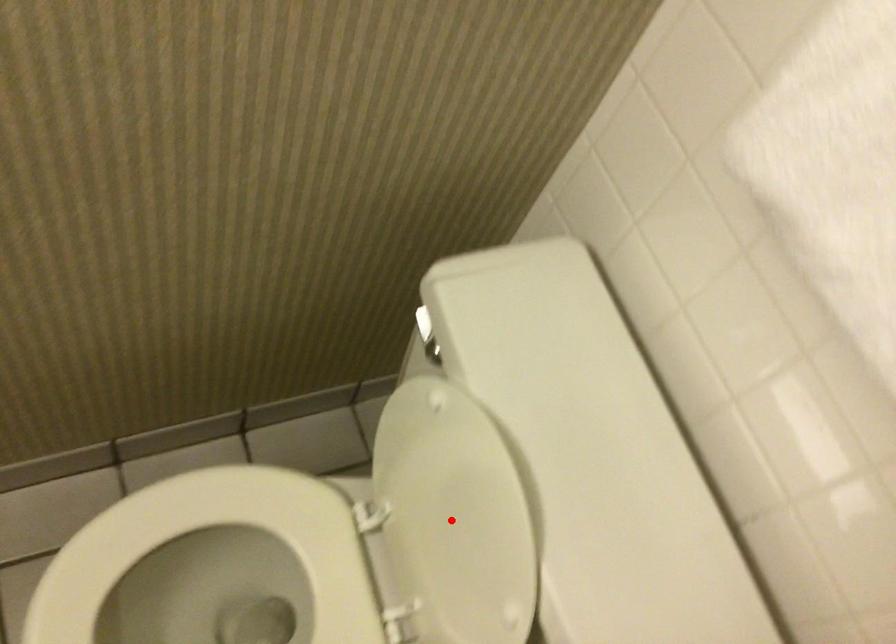
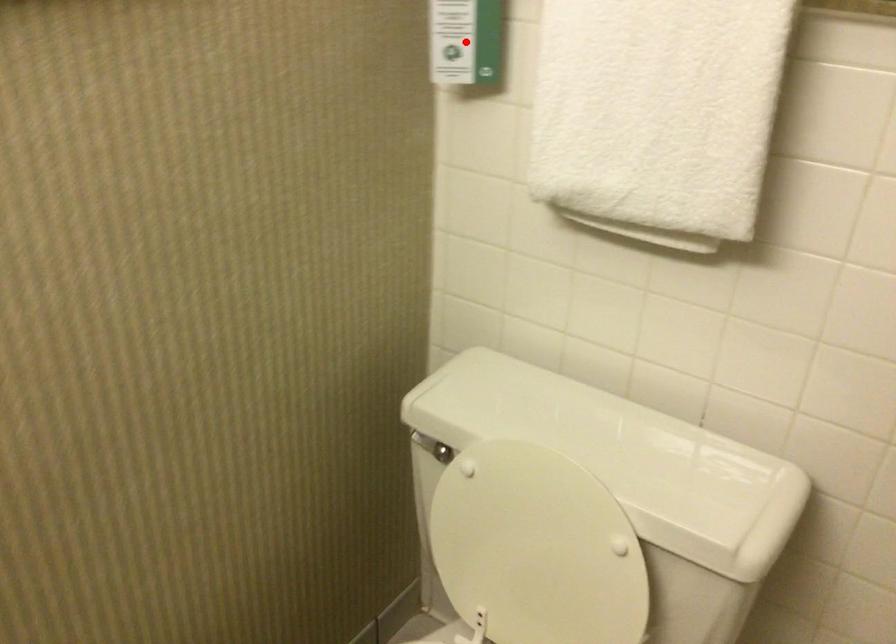
I am providing you with two images of the same scene from different viewpoints. A red point is marked on the first image and another point is marked on the second image. Is the red point in image1 aligned with the point shown in image2?

No